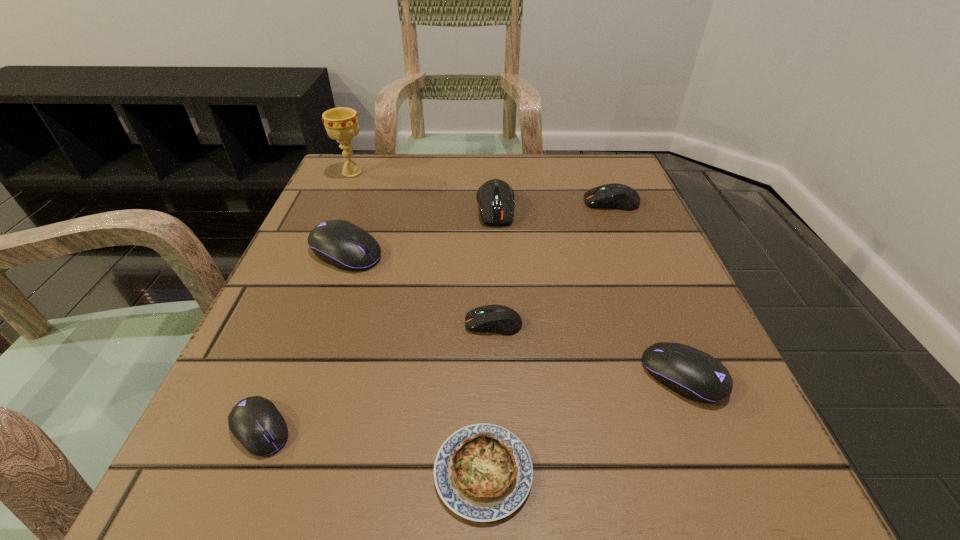
Where is `the tallest object`? the tallest object is located at coordinates (341, 124).

Find the location of a particular element. This screenshot has width=960, height=540. the farthest object is located at coordinates (341, 124).

Where is `the biggest dark computer equipment`? This screenshot has height=540, width=960. the biggest dark computer equipment is located at coordinates (496, 201).

Locate an element on the screen. the fifth nearest object is located at coordinates (340, 243).

Find the location of a particular element. the farthest black computer mouse is located at coordinates (340, 243).

Locate an element on the screen. The image size is (960, 540). the rightmost dark computer equipment is located at coordinates (611, 196).

The height and width of the screenshot is (540, 960). Identify the location of the second smallest black computer mouse. (693, 374).

You are a GUI agent. You are given a task and a screenshot of the screen. Output one action in this format:
    pyautogui.click(x=<x>, y=<y>)
    Task: Click on the fifth farthest object
    This screenshot has width=960, height=540.
    Given the screenshot: What is the action you would take?
    pyautogui.click(x=499, y=319)

Locate an element on the screen. The width and height of the screenshot is (960, 540). the nearest dark computer equipment is located at coordinates (499, 319).

The width and height of the screenshot is (960, 540). What are the coordinates of `the smallest black computer mouse` in the screenshot? It's located at (255, 422).